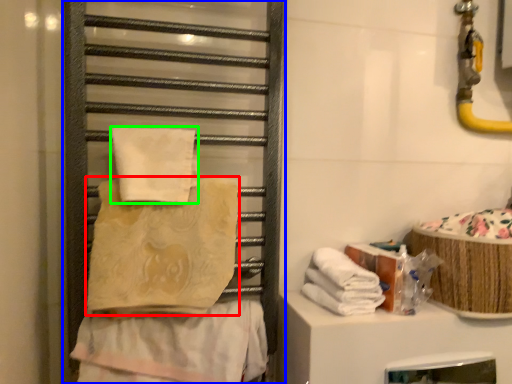
Question: Estimate the real-world distances between objects in this image. Which object is farther from towel (highlighted by a red box), cage (highlighted by a blue box) or towel (highlighted by a green box)?

Choices:
 (A) cage
 (B) towel

Answer: (A)